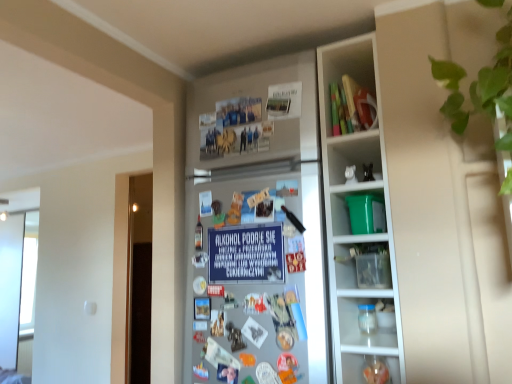
What do you see at coordinates (480, 88) in the screenshot? This screenshot has width=512, height=384. I see `green leafy plant at upper right` at bounding box center [480, 88].

The height and width of the screenshot is (384, 512). Describe the element at coordinates (254, 228) in the screenshot. I see `metallic refrigerator at center` at that location.

In order to face blue paper sign at center, should I rotate leftwards or rightwards?

To align with it, rotate left about 1.522°.

What is the approximate width of blue paper sign at center?

0.96 inches.

Image resolution: width=512 pixels, height=384 pixels. In order to click on green leafy plant at upper right in this screenshot , I will do `click(480, 88)`.

From the image's perspective, between metallic refrigerator at center and matte plastic toys at upper right, positioned as the 2th cabinet in bottom-to-top order, which one is located above?

matte plastic toys at upper right, positioned as the 2th cabinet in bottom-to-top order, from the image's perspective.

How much distance is there between metallic refrigerator at center and matte plastic toys at upper right, positioned as the 2th cabinet in bottom-to-top order?

metallic refrigerator at center is 13.15 inches away from matte plastic toys at upper right, positioned as the 2th cabinet in bottom-to-top order.

From a real-world perspective, is metallic refrigerator at center on matte plastic toys at upper right, the 1th cabinet positioned from the top?

No, from a real-world perspective, metallic refrigerator at center is not above matte plastic toys at upper right, the 1th cabinet positioned from the top.

Consider the image. Could you tell me if metallic refrigerator at center is facing matte plastic toys at upper right, positioned as the 2th cabinet in bottom-to-top order?

No, metallic refrigerator at center is not aimed at matte plastic toys at upper right, positioned as the 2th cabinet in bottom-to-top order.

Considering the relative sizes of green plastic bucket at upper right, the first cabinet ordered from the bottom, and blue paper sign at center in the image provided, is green plastic bucket at upper right, the first cabinet ordered from the bottom, shorter than blue paper sign at center?

Yes.

Based on the photo, is green plastic bucket at upper right, which is counted as the 2th cabinet, starting from the top, not within blue paper sign at center?

Yes, green plastic bucket at upper right, which is counted as the 2th cabinet, starting from the top, is located beyond the bounds of blue paper sign at center.

From the image's perspective, is green plastic bucket at upper right, which is counted as the 2th cabinet, starting from the top, above or below blue paper sign at center?

From the image's perspective, green plastic bucket at upper right, which is counted as the 2th cabinet, starting from the top, appears above blue paper sign at center.

Is matte plastic toys at upper right, the 1th cabinet positioned from the top, aimed at blue paper sign at center?

No, matte plastic toys at upper right, the 1th cabinet positioned from the top, is not facing towards blue paper sign at center.

In the scene shown: From the image's perspective, who appears lower, matte plastic toys at upper right, positioned as the 2th cabinet in bottom-to-top order, or blue paper sign at center?

blue paper sign at center.

Is point (367, 44) positioned behind point (258, 274)?

Yes, it is behind point (258, 274).

From a real-world perspective, is matte plastic toys at upper right, the 1th cabinet positioned from the top, physically above blue paper sign at center?

Yes, from a real-world perspective, matte plastic toys at upper right, the 1th cabinet positioned from the top, is on top of blue paper sign at center.

In the scene shown: Is blue paper sign at center oriented away from green leafy plant at upper right?

No, blue paper sign at center's orientation is not away from green leafy plant at upper right.

Would you say blue paper sign at center is inside or outside green leafy plant at upper right?

blue paper sign at center lies outside green leafy plant at upper right.

Is blue paper sign at center positioned far away from green leafy plant at upper right?

No.

Does green leafy plant at upper right come in front of metallic refrigerator at center?

Yes, it is in front of metallic refrigerator at center.

From the image's perspective, is green leafy plant at upper right on top of metallic refrigerator at center?

Yes, from the image's perspective, green leafy plant at upper right is on top of metallic refrigerator at center.

Between green leafy plant at upper right and metallic refrigerator at center, which one has larger size?

With larger size is green leafy plant at upper right.

Find the location of a particular element. cabinet in front of the transparent plastic jar at lower right is located at coordinates (358, 209).

Which is closer to the camera, (335, 215) or (379, 381)?

Point (335, 215) is positioned farther from the camera compared to point (379, 381).

Which is more to the left, green plastic bucket at upper right, the first cabinet ordered from the bottom, or transparent plastic jar at lower right?

From the viewer's perspective, green plastic bucket at upper right, the first cabinet ordered from the bottom, appears more on the left side.

Is green plastic bucket at upper right, the first cabinet ordered from the bottom, in contact with transparent plastic jar at lower right?

No, green plastic bucket at upper right, the first cabinet ordered from the bottom, is not making contact with transparent plastic jar at lower right.

Where is `the 2nd cabinet behind the green leafy plant at upper right`? the 2nd cabinet behind the green leafy plant at upper right is located at coordinates (347, 70).

From the picture: Which object is further away from the camera, green leafy plant at upper right or matte plastic toys at upper right, positioned as the 2th cabinet in bottom-to-top order?

Positioned behind is matte plastic toys at upper right, positioned as the 2th cabinet in bottom-to-top order.

Consider the image. Considering the sizes of green leafy plant at upper right and matte plastic toys at upper right, the 1th cabinet positioned from the top, in the image, is green leafy plant at upper right taller or shorter than matte plastic toys at upper right, the 1th cabinet positioned from the top,?

Clearly, green leafy plant at upper right is taller compared to matte plastic toys at upper right, the 1th cabinet positioned from the top.

What are the coordinates of `fridge below the matte plastic toys at upper right, the 1th cabinet positioned from the top (from a real-world perspective)` in the screenshot? It's located at (254, 228).

Image resolution: width=512 pixels, height=384 pixels. What are the coordinates of `writing on the left of green plastic bucket at upper right, which is counted as the 2th cabinet, starting from the top` in the screenshot? It's located at (246, 254).

Considering their positions, is matte plastic toys at upper right, positioned as the 2th cabinet in bottom-to-top order, positioned further to metallic refrigerator at center than green leafy plant at upper right?

green leafy plant at upper right.

Which object lies nearer to the anchor point green plastic bucket at upper right, the first cabinet ordered from the bottom, matte plastic toys at upper right, positioned as the 2th cabinet in bottom-to-top order, or transparent plastic jar at lower right?

matte plastic toys at upper right, positioned as the 2th cabinet in bottom-to-top order, lies closer to green plastic bucket at upper right, the first cabinet ordered from the bottom, than the other object.

Based on their spatial positions, is green plastic bucket at upper right, which is counted as the 2th cabinet, starting from the top, or matte plastic toys at upper right, positioned as the 2th cabinet in bottom-to-top order, further from blue paper sign at center?

Among the two, matte plastic toys at upper right, positioned as the 2th cabinet in bottom-to-top order, is located further to blue paper sign at center.

Based on their spatial positions, is matte plastic toys at upper right, the 1th cabinet positioned from the top, or green plastic bucket at upper right, the first cabinet ordered from the bottom, closer to blue paper sign at center?

green plastic bucket at upper right, the first cabinet ordered from the bottom, lies closer to blue paper sign at center than the other object.

Looking at the image, which one is located further to matte plastic toys at upper right, positioned as the 2th cabinet in bottom-to-top order, metallic refrigerator at center or green leafy plant at upper right?

Among the two, green leafy plant at upper right is located further to matte plastic toys at upper right, positioned as the 2th cabinet in bottom-to-top order.

Considering their positions, is matte plastic toys at upper right, the 1th cabinet positioned from the top, positioned further to green leafy plant at upper right than transparent plastic jar at lower right?

Based on the image, transparent plastic jar at lower right appears to be further to green leafy plant at upper right.

Looking at the image, which one is located further to green leafy plant at upper right, green plastic bucket at upper right, which is counted as the 2th cabinet, starting from the top, or matte plastic toys at upper right, the 1th cabinet positioned from the top?

green plastic bucket at upper right, which is counted as the 2th cabinet, starting from the top, is further to green leafy plant at upper right.

Which object lies nearer to the anchor point matte plastic toys at upper right, positioned as the 2th cabinet in bottom-to-top order, green leafy plant at upper right or metallic refrigerator at center?

The object closer to matte plastic toys at upper right, positioned as the 2th cabinet in bottom-to-top order, is metallic refrigerator at center.

Locate an element on the screen. This screenshot has width=512, height=384. writing between matte plastic toys at upper right, positioned as the 2th cabinet in bottom-to-top order, and transparent plastic jar at lower right in the up-down direction is located at coordinates (246, 254).

What are the coordinates of `cabinet located between green leafy plant at upper right and blue paper sign at center in the depth direction` in the screenshot? It's located at (358, 209).

You are a GUI agent. You are given a task and a screenshot of the screen. Output one action in this format:
    pyautogui.click(x=<x>, y=<y>)
    Task: Click on the fridge located between blue paper sign at center and transparent plastic jar at lower right in the left-right direction
    This screenshot has height=384, width=512.
    Given the screenshot: What is the action you would take?
    pyautogui.click(x=254, y=228)

The image size is (512, 384). What are the coordinates of `cabinet between matte plastic toys at upper right, the 1th cabinet positioned from the top, and transparent plastic jar at lower right, in the vertical direction` in the screenshot? It's located at (358, 209).